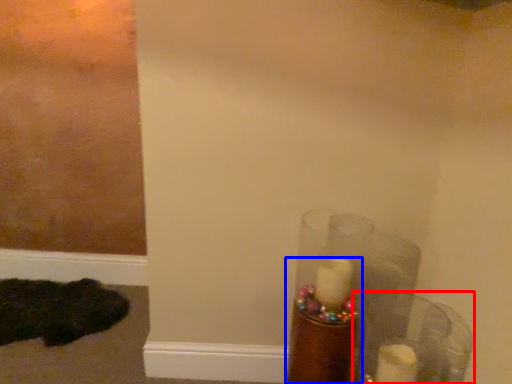
Question: Which object is closer to the camera taking this photo, glass vase (highlighted by a red box) or candle holder (highlighted by a blue box)?

Choices:
 (A) glass vase
 (B) candle holder

Answer: (A)